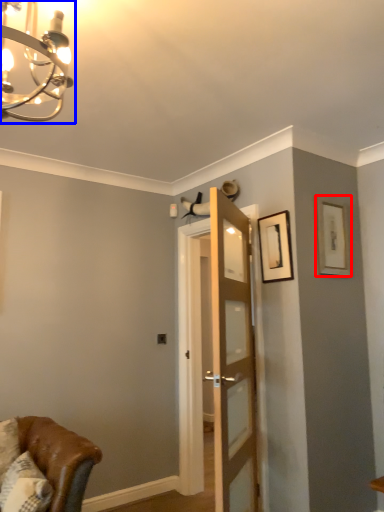
Question: Which of the following is the farthest to the observer, picture frame (highlighted by a red box) or light fixture (highlighted by a blue box)?

Choices:
 (A) picture frame
 (B) light fixture

Answer: (A)